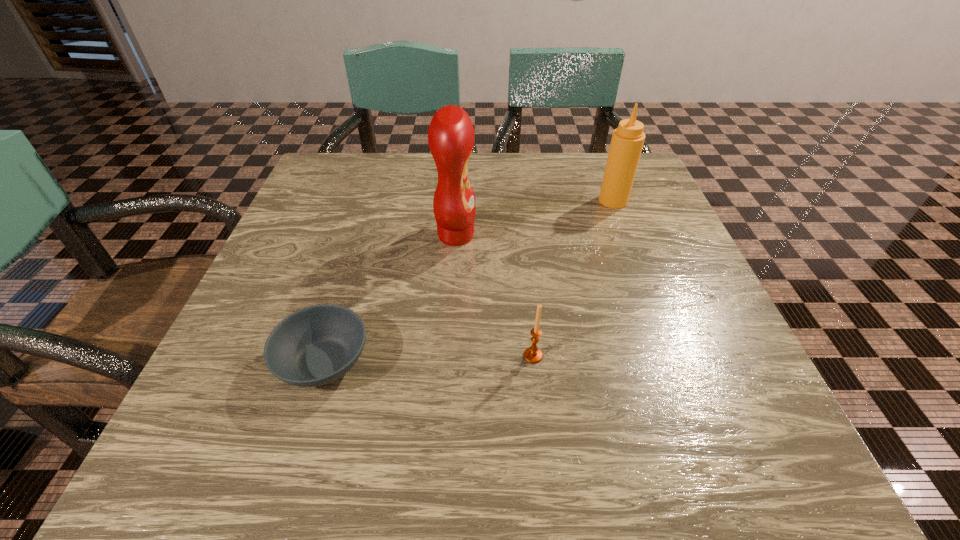
Locate an element on the screen. This screenshot has height=540, width=960. empty space that is in between the soup bowl and the farther condiment is located at coordinates (468, 281).

The height and width of the screenshot is (540, 960). In order to click on free space between the right condiment and the shortest object in this screenshot , I will do `click(468, 281)`.

The image size is (960, 540). Identify the location of vacant area between the candle_holder and the soup bowl. (428, 359).

Locate which object ranks third in proximity to the right condiment. Please provide its 2D coordinates. Your answer should be formatted as a tuple, i.e. [(x, y)], where the tuple contains the x and y coordinates of a point satisfying the conditions above.

[(314, 346)]

Where is `object that is the second nearest to the third tallest object`? object that is the second nearest to the third tallest object is located at coordinates (314, 346).

At what (x,y) coordinates should I click in order to perform the action: click on free space that satisfies the following two spatial constraints: 1. on the label side of the candle_holder; 2. on the left side of the nearer condiment. Please return your answer as a coordinate pair (x, y). Looking at the image, I should click on (448, 356).

You are a GUI agent. You are given a task and a screenshot of the screen. Output one action in this format:
    pyautogui.click(x=<x>, y=<y>)
    Task: Click on the free space that satisfies the following two spatial constraints: 1. on the front side of the farther condiment; 2. on the label side of the second object from left to right
    Image resolution: width=960 pixels, height=540 pixels.
    Given the screenshot: What is the action you would take?
    pyautogui.click(x=626, y=235)

Locate an element on the screen. This screenshot has width=960, height=540. free space that satisfies the following two spatial constraints: 1. on the back side of the shorter condiment; 2. on the right side of the shortest object is located at coordinates (373, 201).

Identify the location of free space that satisfies the following two spatial constraints: 1. on the front side of the shorter condiment; 2. on the label side of the left condiment. This screenshot has width=960, height=540. (626, 235).

The image size is (960, 540). I want to click on blank area in the image that satisfies the following two spatial constraints: 1. on the label side of the third object from left to right; 2. on the right side of the left condiment, so click(x=448, y=356).